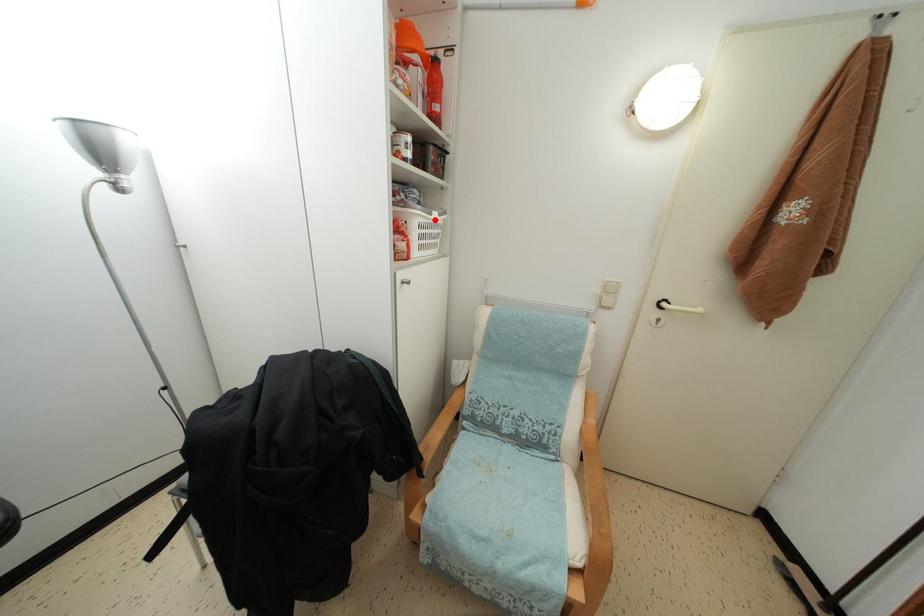
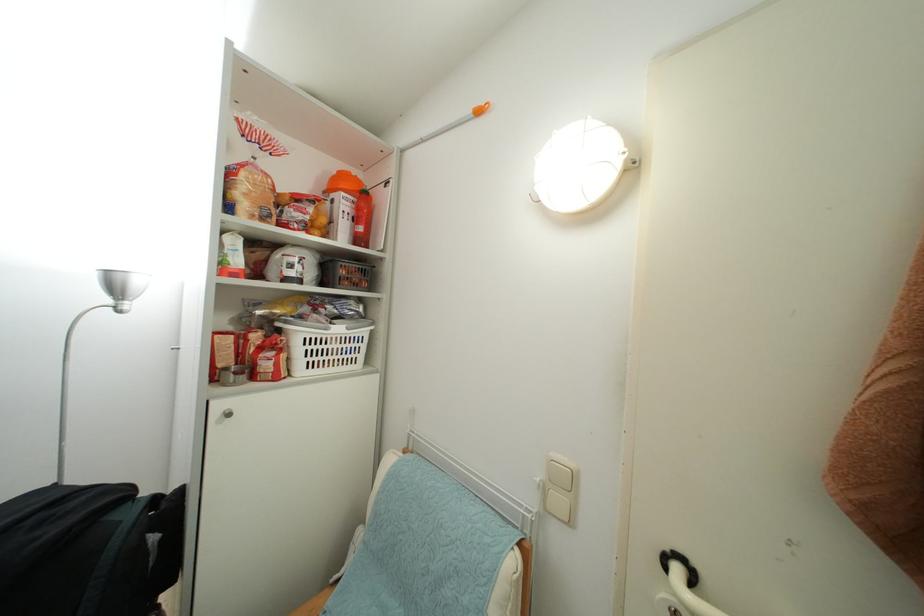
The point at the highlighted location is marked in the first image. Where is the corresponding point in the second image?

(331, 334)